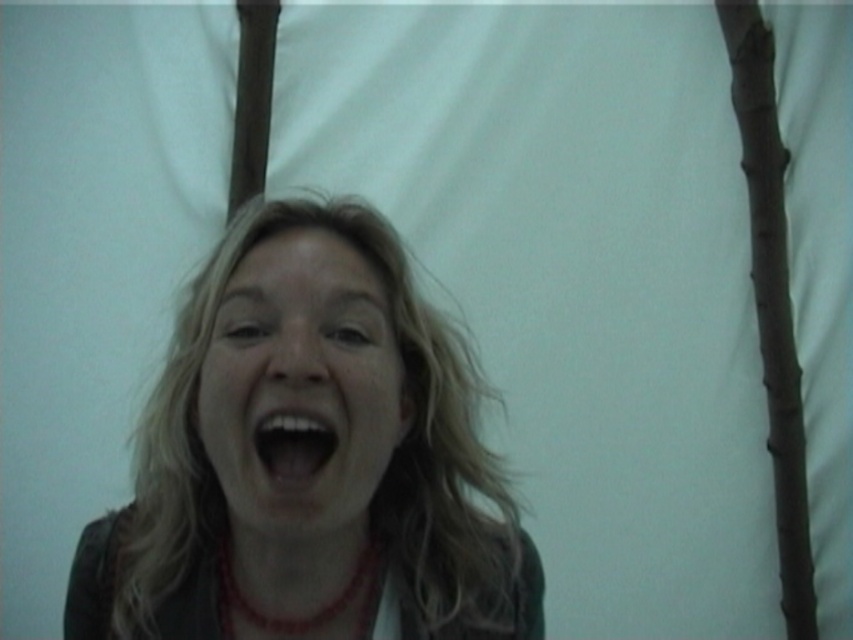
Question: Which point is farther from the camera taking this photo?

Choices:
 (A) pos(294,420)
 (B) pos(252,436)

Answer: (B)

Question: Which object is positioned closest to the matte brown hair at center?

Choices:
 (A) smooth white teeth at center
 (B) smooth skin face at center

Answer: (B)

Question: Does matte brown hair at center appear on the right side of smooth white teeth at center?

Choices:
 (A) no
 (B) yes

Answer: (A)

Question: Which point is farther to the camera?

Choices:
 (A) (379, 426)
 (B) (267, 429)
 (C) (461, 602)

Answer: (C)

Question: Is matte brown hair at center below smooth white teeth at center?

Choices:
 (A) no
 (B) yes

Answer: (B)

Question: Is smooth skin face at center thinner than red beaded necklace at center?

Choices:
 (A) no
 (B) yes

Answer: (A)